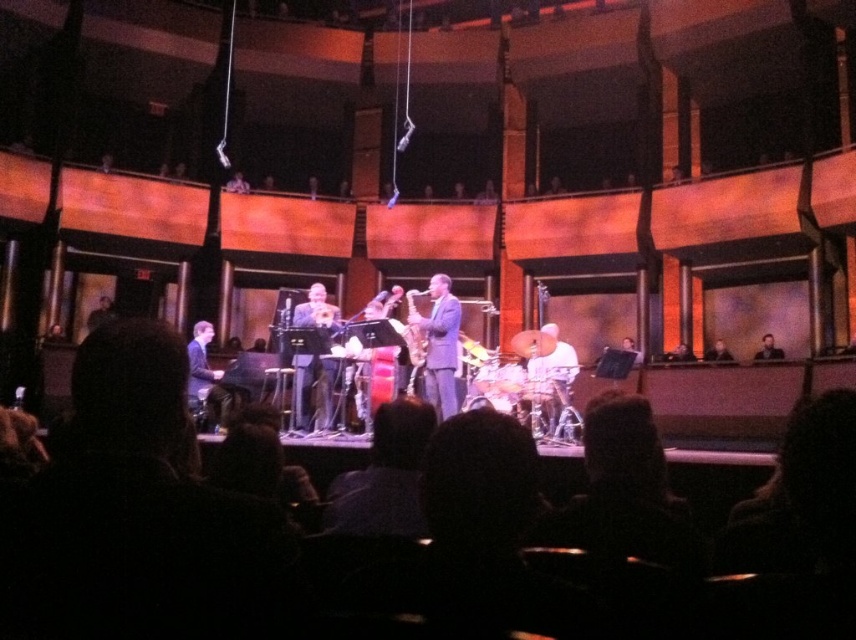
Question: Among these objects, which one is nearest to the camera?

Choices:
 (A) matte gold saxophone at center
 (B) light brown wooden chair at right
 (C) shiny gold saxophone at center

Answer: (C)

Question: Can you confirm if shiny silver saxophone at center is positioned below shiny gold saxophone at center?

Choices:
 (A) no
 (B) yes

Answer: (B)

Question: Is shiny silver saxophone at center positioned behind smooth brown leather jacket at upper right?

Choices:
 (A) yes
 (B) no

Answer: (B)

Question: Which point is farther to the camera?

Choices:
 (A) (307, 308)
 (B) (199, 333)
 (C) (758, 355)
 (D) (414, 364)

Answer: (C)

Question: Estimate the real-world distances between objects in this image. Which object is farther from the matte black piano at lower left?

Choices:
 (A) shiny gold saxophone at center
 (B) light brown wooden chair at right
 (C) shiny silver saxophone at center

Answer: (B)

Question: Observing the image, what is the correct spatial positioning of shiny gold saxophone at center in reference to light brown wooden chair at right?

Choices:
 (A) left
 (B) right

Answer: (A)